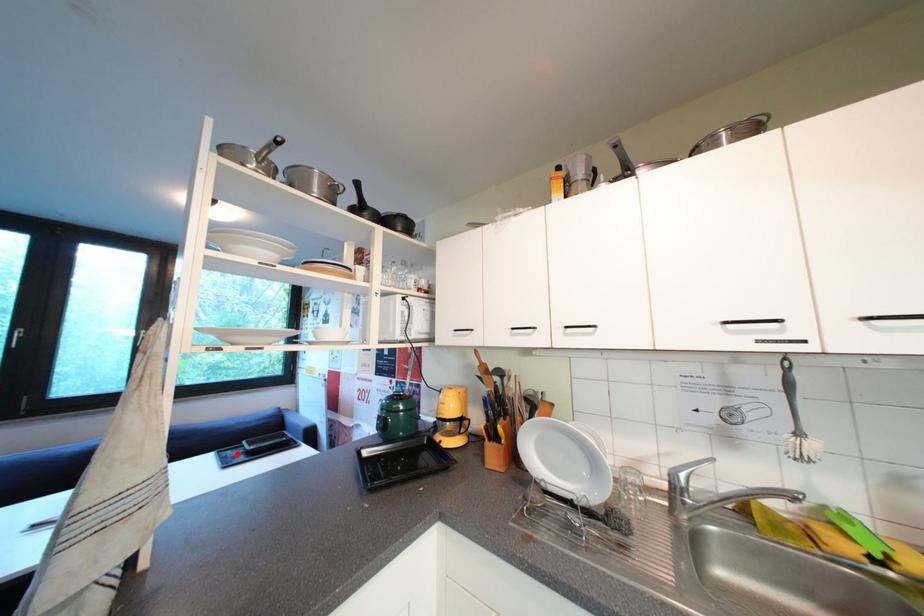
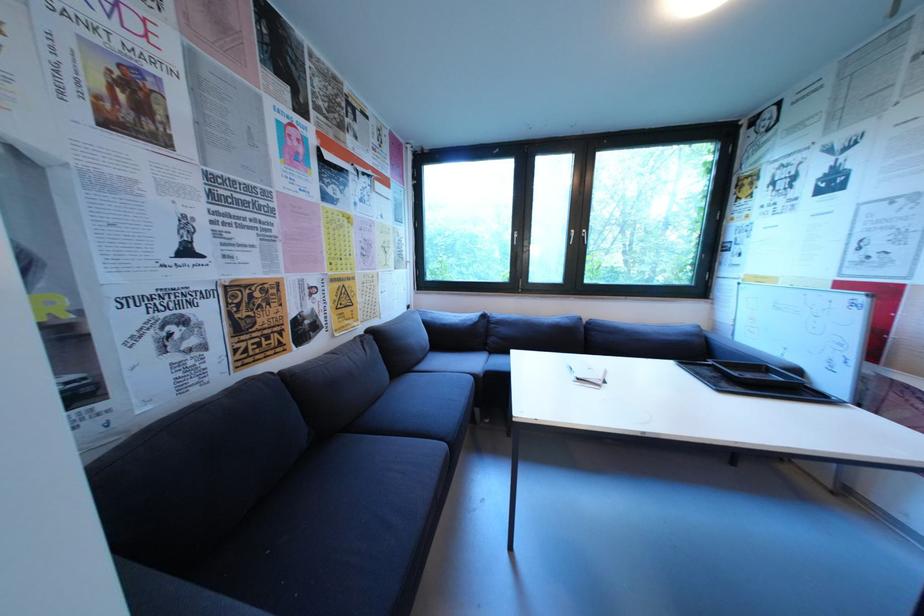
Find the pixel in the second image that matches the highlighted location in the first image.

(699, 369)